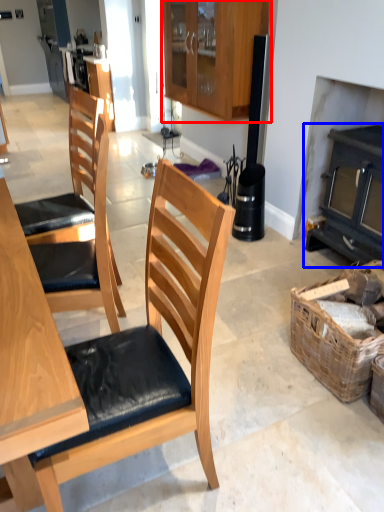
Question: Which point is further to the camera, cabinetry (highlighted by a red box) or fireplace (highlighted by a blue box)?

Choices:
 (A) cabinetry
 (B) fireplace

Answer: (A)